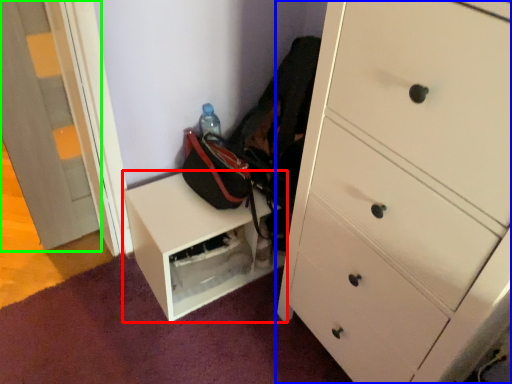
Question: Which object is the farthest from furniture (highlighted by a red box)? Choose among these: chest of drawers (highlighted by a blue box) or door (highlighted by a green box).

Choices:
 (A) chest of drawers
 (B) door

Answer: (B)